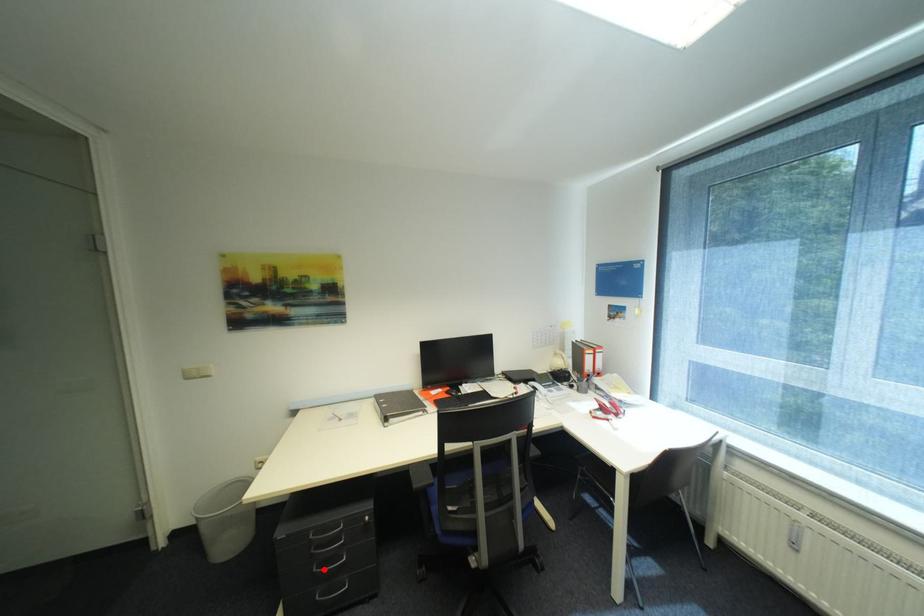
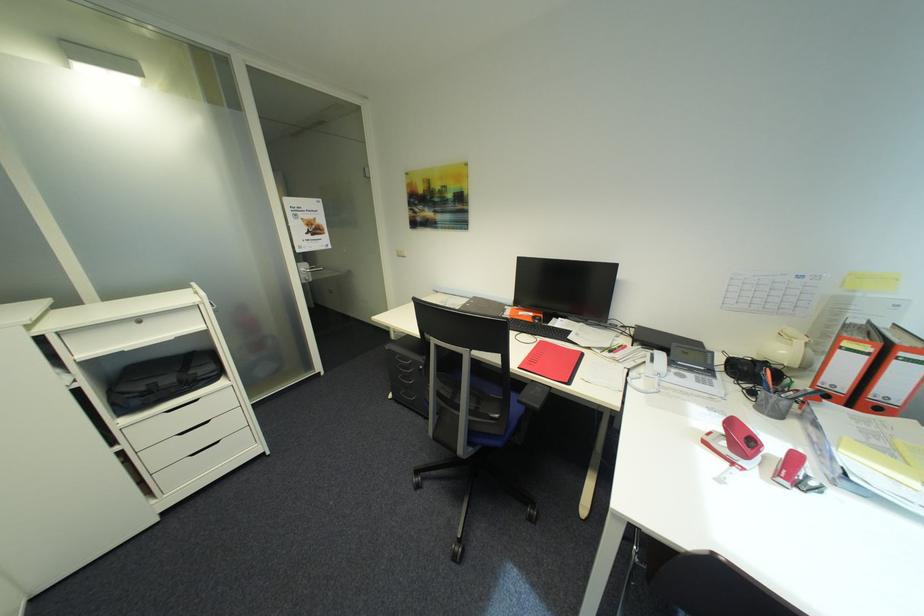
Question: I am providing you with two images of the same scene from different viewpoints. A red point is marked on the first image. Is the red point's position out of view in image 2?

Choices:
 (A) Yes
 (B) No

Answer: (B)